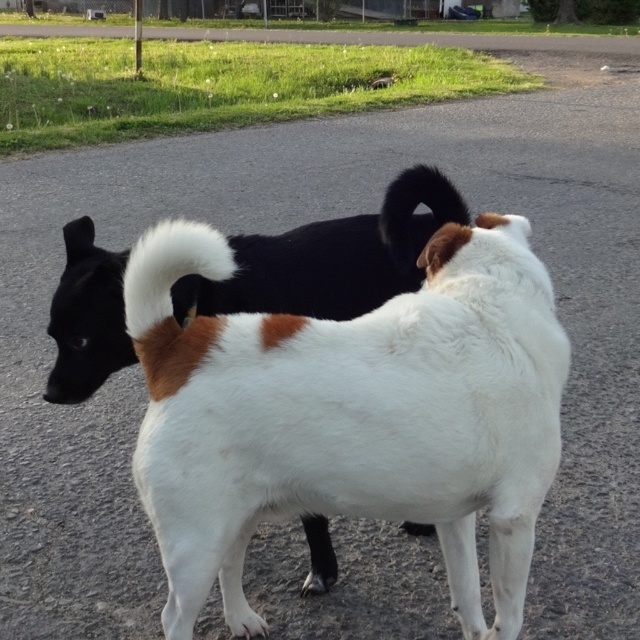
Question: Is white fur dog at center smaller than black fur tail at upper center?

Choices:
 (A) yes
 (B) no

Answer: (B)

Question: Which object appears closest to the camera in this image?

Choices:
 (A) black fur tail at upper center
 (B) white fur dog at center

Answer: (A)

Question: From the image, what is the correct spatial relationship of white fur dog at center in relation to black fur tail at upper center?

Choices:
 (A) left
 (B) right

Answer: (A)

Question: Can you confirm if white fur dog at center is smaller than black fur tail at upper center?

Choices:
 (A) no
 (B) yes

Answer: (A)